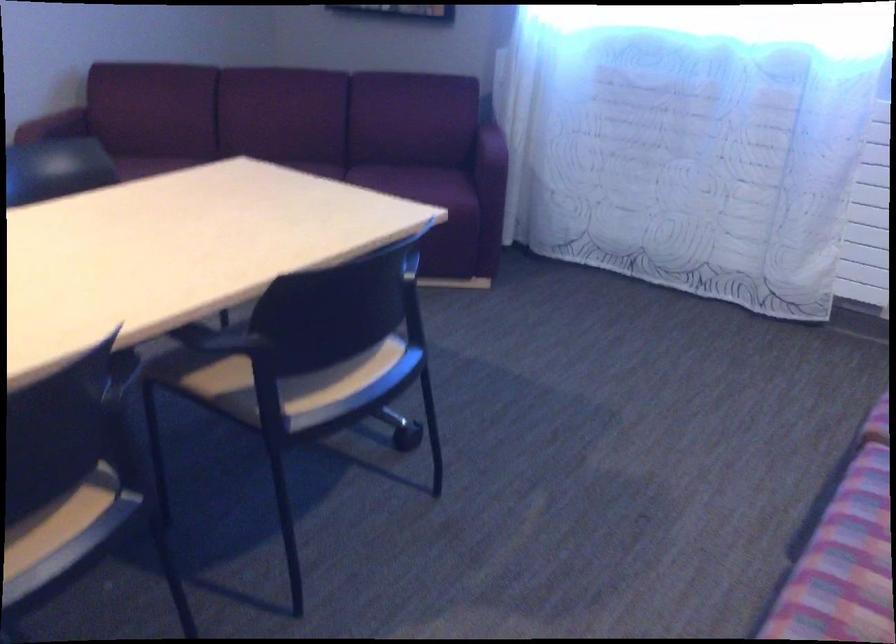
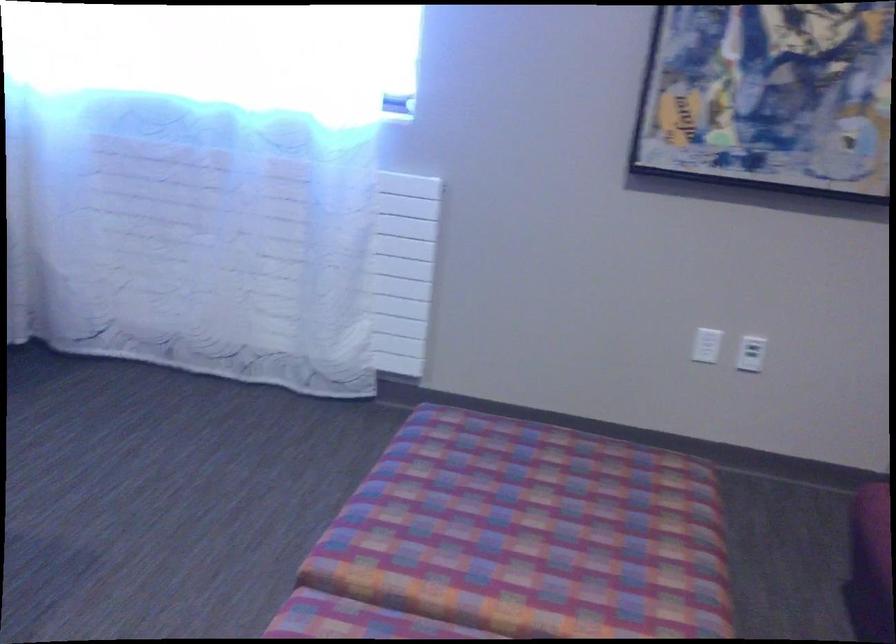
Question: The camera is either moving clockwise (left) or counter-clockwise (right) around the object. The first image is from the beginning of the video and the second image is from the end. Is the camera moving left or right when shooting the video?

Choices:
 (A) Left
 (B) Right

Answer: (A)